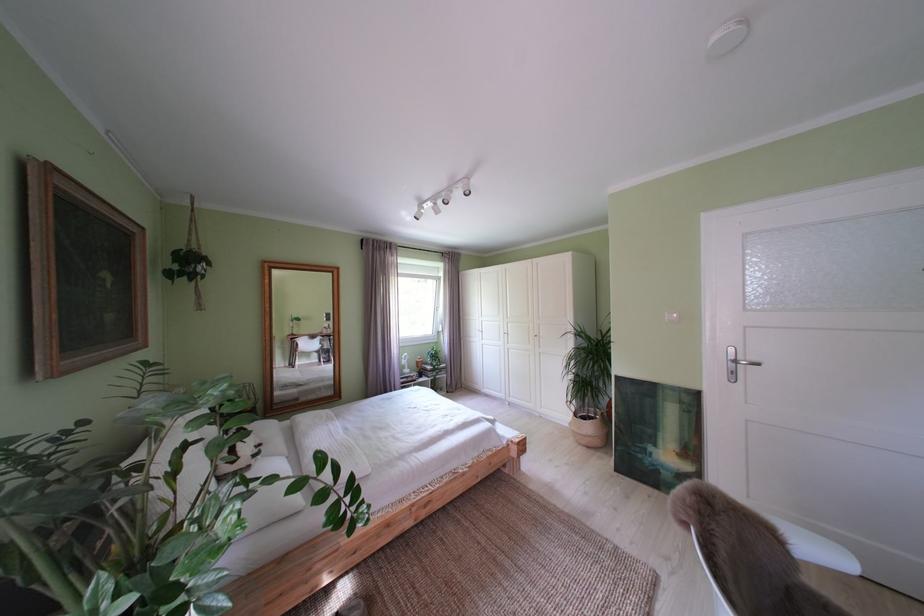
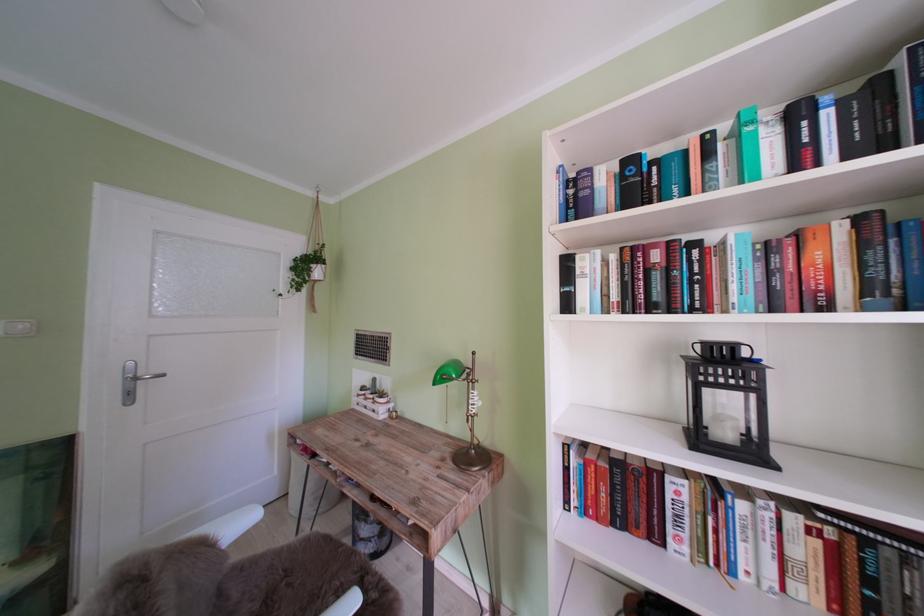
Question: Based on the continuous images, in which direction is the camera rotating? Reply with the corresponding letter.

Choices:
 (A) Left
 (B) Right
 (C) Up
 (D) Down

Answer: (B)